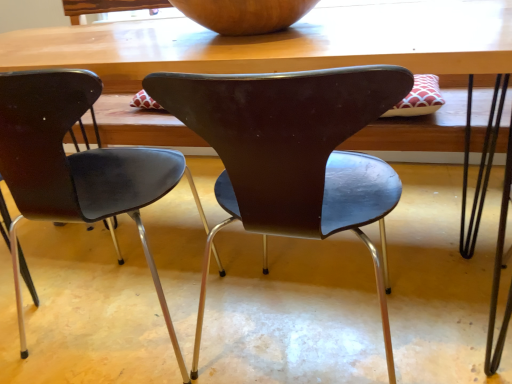
Question: Does matte black chair at center, the 2th chair in the right-to-left sequence, have a smaller size compared to wooden bowl at upper center?

Choices:
 (A) yes
 (B) no

Answer: (B)

Question: From a real-world perspective, is matte black chair at center, which is counted as the 1th chair, starting from the left, over wooden bowl at upper center?

Choices:
 (A) no
 (B) yes

Answer: (A)

Question: Can you confirm if matte black chair at center, which is counted as the 1th chair, starting from the left, is positioned to the right of wooden bowl at upper center?

Choices:
 (A) yes
 (B) no

Answer: (B)

Question: Considering the relative sizes of matte black chair at center, which is counted as the 1th chair, starting from the left, and wooden bowl at upper center in the image provided, is matte black chair at center, which is counted as the 1th chair, starting from the left, thinner than wooden bowl at upper center?

Choices:
 (A) yes
 (B) no

Answer: (B)

Question: Is matte black chair at center, the 2th chair in the right-to-left sequence, facing away from wooden bowl at upper center?

Choices:
 (A) yes
 (B) no

Answer: (B)

Question: Can you confirm if matte black chair at center, the 2th chair in the right-to-left sequence, is taller than wooden bowl at upper center?

Choices:
 (A) yes
 (B) no

Answer: (A)

Question: Is wooden bowl at upper center positioned before wooden table at center?

Choices:
 (A) yes
 (B) no

Answer: (B)

Question: Is wooden table at center at the back of wooden bowl at upper center?

Choices:
 (A) no
 (B) yes

Answer: (A)

Question: Can you confirm if wooden bowl at upper center is taller than wooden table at center?

Choices:
 (A) no
 (B) yes

Answer: (A)

Question: Considering the relative positions of wooden bowl at upper center and wooden table at center in the image provided, is wooden bowl at upper center to the right of wooden table at center from the viewer's perspective?

Choices:
 (A) no
 (B) yes

Answer: (B)

Question: From the image's perspective, would you say wooden bowl at upper center is positioned over wooden table at center?

Choices:
 (A) yes
 (B) no

Answer: (A)

Question: Is wooden bowl at upper center further to camera compared to wooden table at center?

Choices:
 (A) no
 (B) yes

Answer: (B)

Question: Can you confirm if wooden table at center is positioned to the left of wooden bowl at upper center?

Choices:
 (A) no
 (B) yes

Answer: (B)